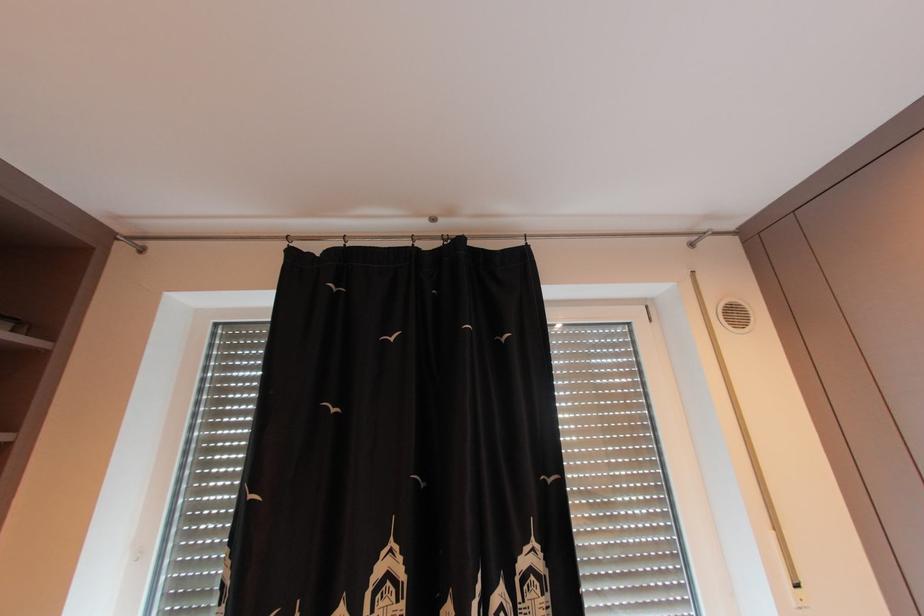
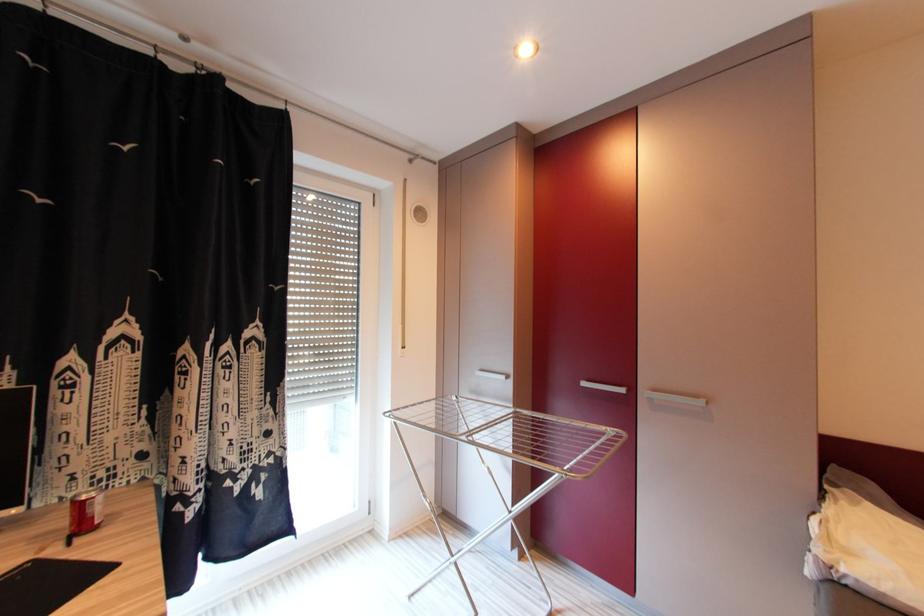
Question: How did the camera likely rotate?

Choices:
 (A) Left
 (B) Right
 (C) Up
 (D) Down

Answer: (B)